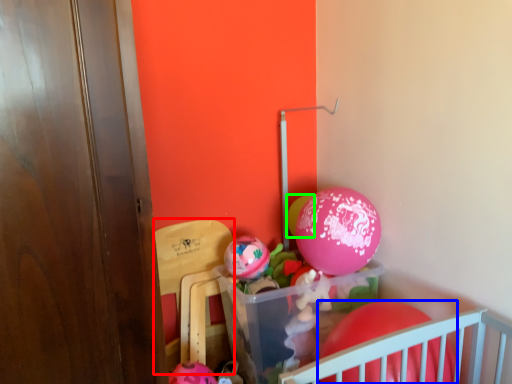
Question: Which is farther away from armchair (highlighted by a red box)? balloon (highlighted by a blue box) or balloon (highlighted by a green box)?

Choices:
 (A) balloon
 (B) balloon

Answer: (A)